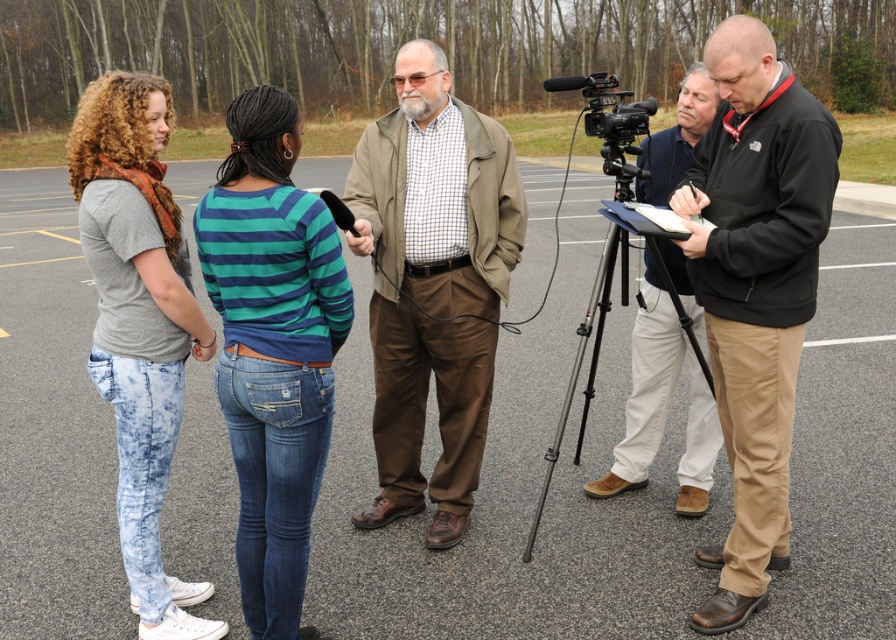
You are standing in the parking lot and want to walk to the point closer to the camera between the two points labeled as point [789,300] and point [610,236]. Which point should you head towards?

You should head towards point [789,300] because it is closer to the camera than point [610,236].

You are a photographer standing in the scene. You need to position yourself so that the brown cotton pants at center and the black plastic video camera at right are both visible in your shot. Which object should you ensure is closer to the bottom of the frame?

The brown cotton pants at center should be closer to the bottom of the frame because it is positioned below the black plastic video camera at right.